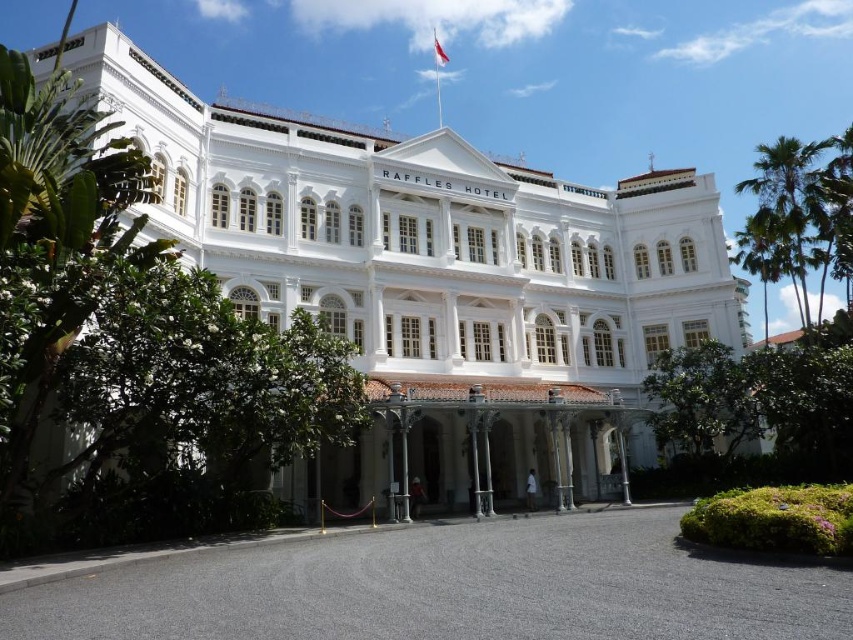
Looking at the Raffles Hotel scene, there is a white stone building at center and a green leafy palm tree at upper right. Which of these two objects is positioned more to the left side of the image?

The white stone building at center is positioned to the left of the green leafy palm tree at upper right, so it is more to the left side of the image.

You are standing in front of the Raffles Hotel and want to take a photo that includes both the white stone building at center and the green leafy palm tree at upper right. Based on their positions, where should you position yourself to ensure both are visible in the frame?

The white stone building at center is located below the green leafy palm tree at upper right. To include both in your photo, position yourself in a lower position facing upward so the palm tree at upper right appears above the building at center within the frame.